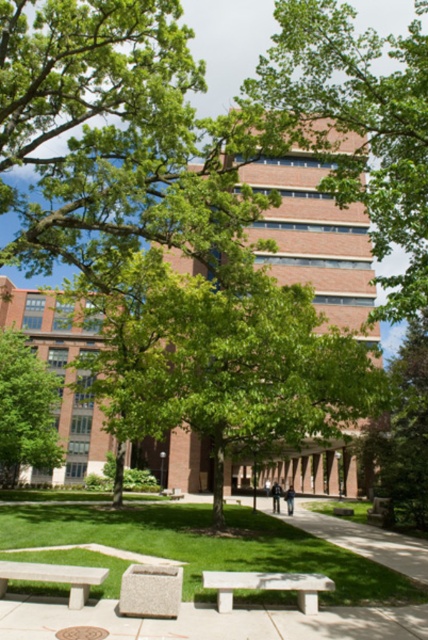
Question: Which of these objects is positioned closest to the green grass at lower center?

Choices:
 (A) green leafy tree at center
 (B) green leafy tree at left
 (C) white concrete bench at lower center

Answer: (C)

Question: Estimate the real-world distances between objects in this image. Which object is farther from the white concrete bench at center?

Choices:
 (A) granite bench at center
 (B) white concrete bench at lower center

Answer: (A)

Question: Observing the image, what is the correct spatial positioning of green leafy tree at center in reference to green grass at lower center?

Choices:
 (A) right
 (B) left

Answer: (B)

Question: In this image, where is white concrete bench at lower center located relative to green leafy tree at left?

Choices:
 (A) left
 (B) right

Answer: (B)

Question: Does green leafy tree at center have a greater width compared to green leafy tree at left?

Choices:
 (A) yes
 (B) no

Answer: (A)

Question: Which point is farther to the camera?

Choices:
 (A) (166, 618)
 (B) (64, 568)

Answer: (B)